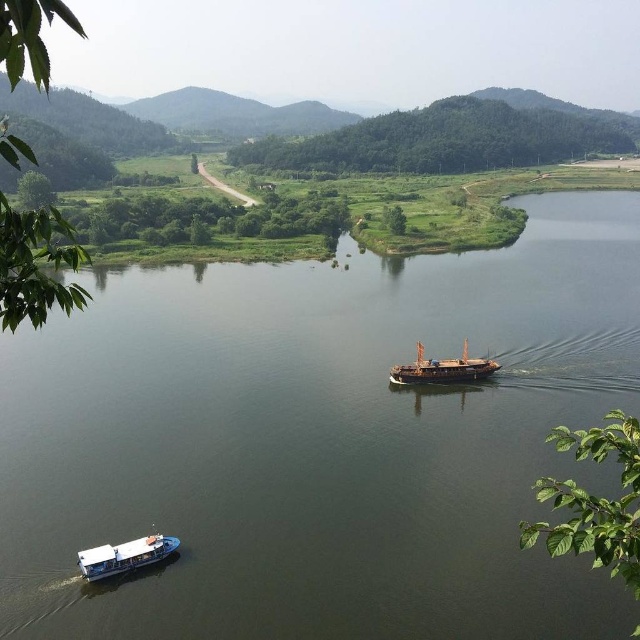
You are planning to cross the green grassy river at center using the white matte boat at lower left. Considering their sizes, will the boat be able to navigate through the river?

The green grassy river at center is larger in size than the white matte boat at lower left, so the boat should have enough space to navigate through the river.

You are a photographer trying to capture both the white matte boat at lower left and the wooden ship at center in a single shot. Based on their positions, which boat should you adjust your camera angle to focus on first to ensure both are in frame?

The white matte boat at lower left is to the left of the wooden ship at center, so adjust your camera angle to focus on the white matte boat at lower left first to ensure both are in frame.

You are standing on the bank of the green grassy river at center and want to board the wooden ship at center. Which direction should you move to reach the ship?

Since the green grassy river at center is closer to you than the wooden ship at center, you should move away from your current position towards the center of the river to reach the wooden ship at center.